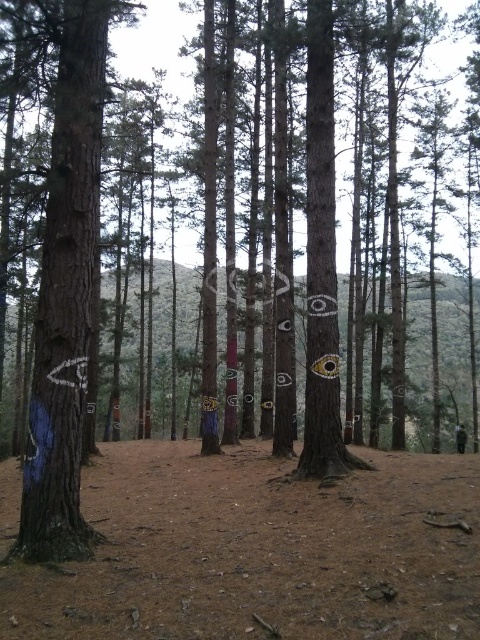
You are a hiker in the forest and want to find the blue painted tree trunk at left. According to the coordinates given, where should you look relative to the center of the image?

The blue painted tree trunk at left is located at coordinates point (67, 294), which means it is positioned to the left and slightly below the center of the image.

You are a hiker who has lost your jacket in a forest. You see a blue painted tree trunk at left and a black leather jacket at center. Which object is located to the left of the other?

The blue painted tree trunk at left is positioned on the left side of black leather jacket at center.